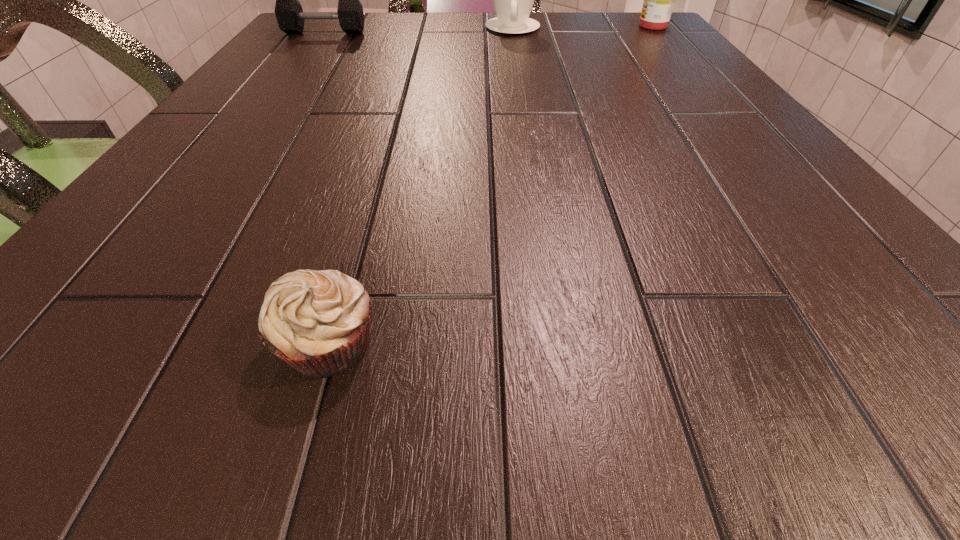
At what (x,y) coordinates should I click in order to perform the action: click on vacant area that lies between the third object from left to right and the rightmost object. Please return your answer as a coordinate pair (x, y). The image size is (960, 540). Looking at the image, I should click on (583, 27).

Identify the location of free space between the third object from right to left and the rightmost object. (491, 185).

Locate an element on the screen. free spot between the rightmost object and the dumbbell is located at coordinates pyautogui.click(x=489, y=30).

Where is `free space between the fruit juice and the leftmost object`? The image size is (960, 540). free space between the fruit juice and the leftmost object is located at coordinates (489, 30).

Choose which object is the nearest neighbor to the tallest object. Please provide its 2D coordinates. Your answer should be formatted as a tuple, i.e. [(x, y)], where the tuple contains the x and y coordinates of a point satisfying the conditions above.

[(513, 0)]

Find the location of `object that is the closest to the third object from left to right`. object that is the closest to the third object from left to right is located at coordinates (659, 0).

Image resolution: width=960 pixels, height=540 pixels. I want to click on vacant space that satisfies the following two spatial constraints: 1. on the label of the tallest object; 2. to the right of the cappuccino's handle, so click(654, 28).

Identify the location of vacant region that satisfies the following two spatial constraints: 1. on the label of the rightmost object; 2. to the right of the second object from right to left's handle. This screenshot has height=540, width=960. (654, 28).